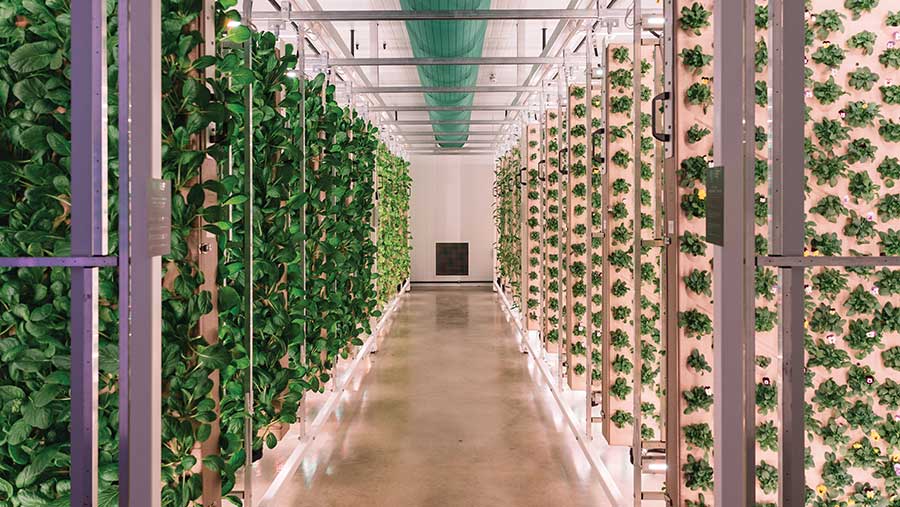
Where is `panel`? panel is located at coordinates (453, 250).